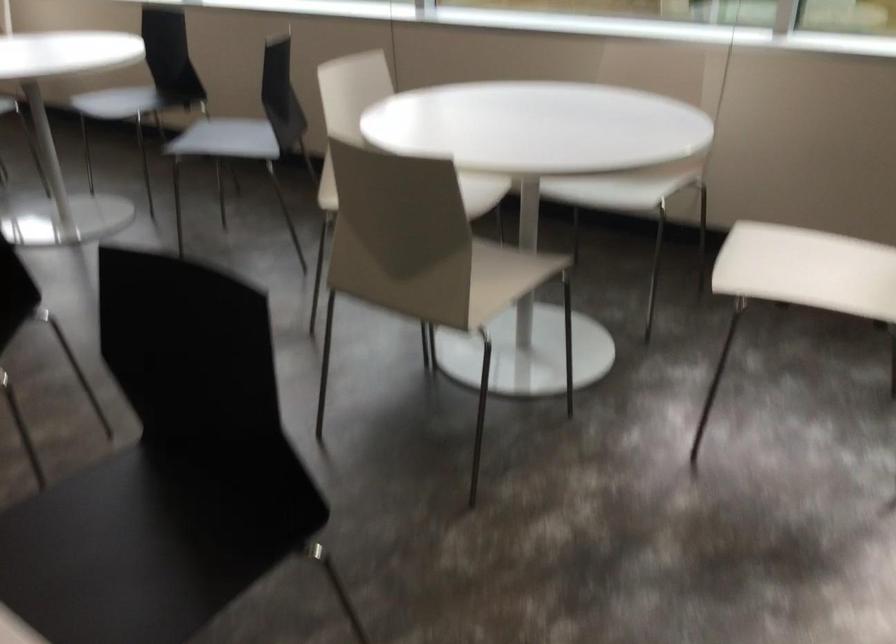
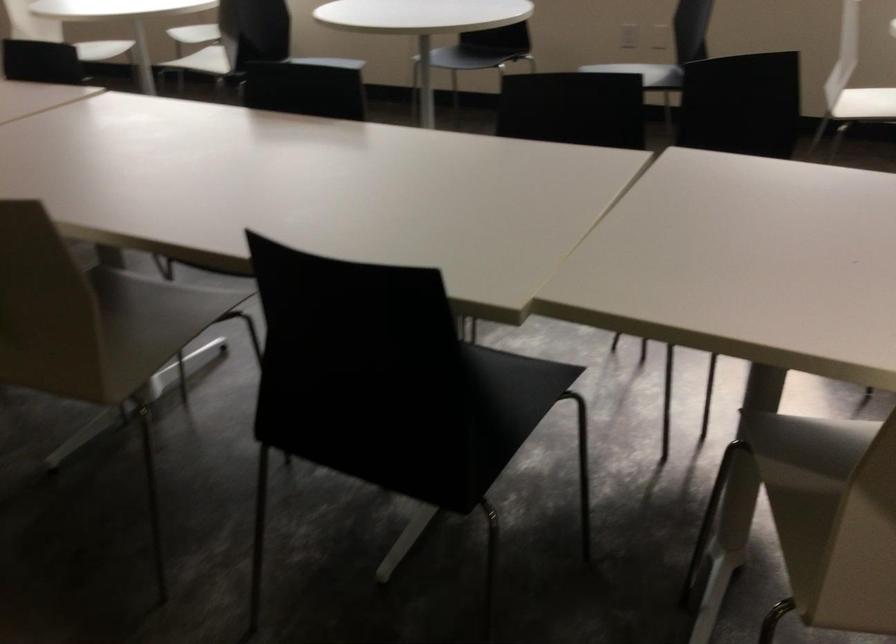
Question: What movement of the cameraman would produce the second image?

Choices:
 (A) Left
 (B) Right
 (C) Forward
 (D) Backward

Answer: (A)